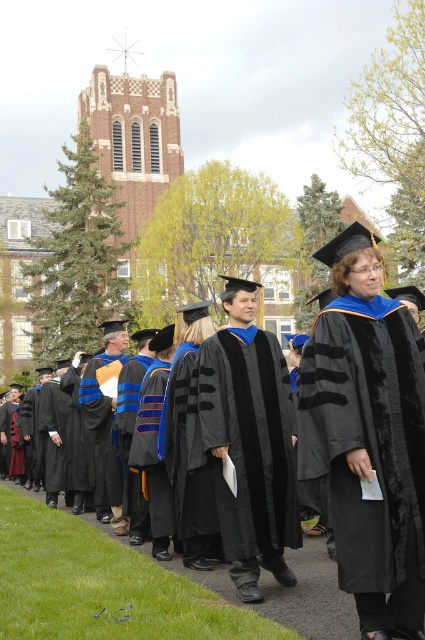
Does velvety black gown at center appear on the right side of matte black gown at center?

Yes, velvety black gown at center is to the right of matte black gown at center.

Between velvety black gown at center and matte black gown at center, which one is positioned higher?

velvety black gown at center is higher up.

The width and height of the screenshot is (425, 640). Identify the location of velvety black gown at center. (368, 454).

Which is more to the left, velvety black gown at center or velvet black gown at center?

velvet black gown at center is more to the left.

Does point (388, 490) come farther from viewer compared to point (312, 621)?

No, it is not.

Identify the location of velvety black gown at center. (368, 454).

Describe the element at coordinates (294, 593) in the screenshot. I see `velvet black gown at center` at that location.

Is point (2, 604) less distant than point (200, 483)?

Yes, point (2, 604) is closer to viewer.

Is point (309, 564) farther from camera compared to point (204, 524)?

Yes, point (309, 564) is farther from viewer.

Locate an element on the screen. The width and height of the screenshot is (425, 640). velvet black gown at center is located at coordinates (294, 593).